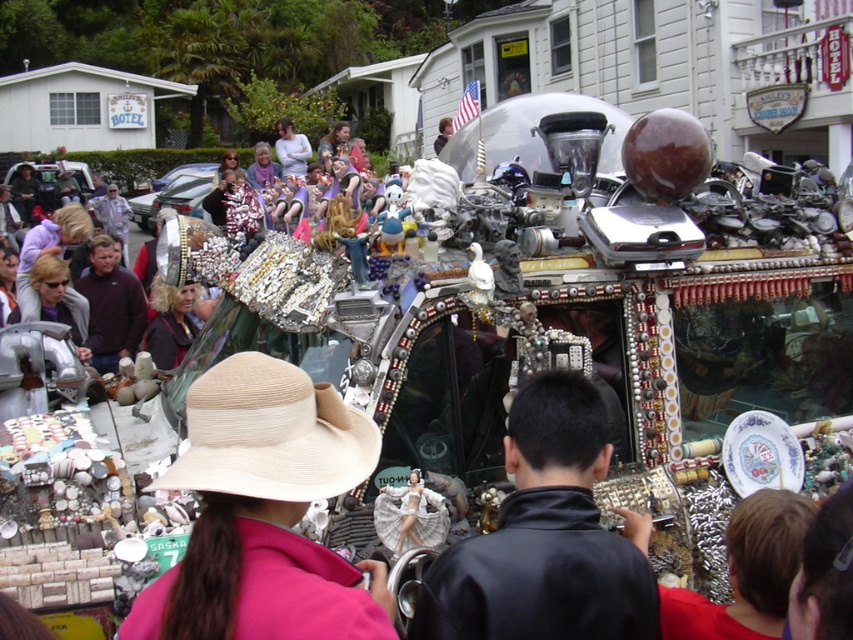
You are a photographer standing in the crowd watching the parade. You want to take a photo of both the pink fabric hat at center and the beige straw hat at center. Which hat will appear larger in your photo?

The pink fabric hat at center will appear larger in the photo because it is closer to the viewer than the beige straw hat at center.

You are a photographer trying to capture a clear photo of the pink fabric hat at center and the black leather jacket at center. Since you want both subjects to be in focus, which object should you adjust your camera focus on first to ensure clarity?

The pink fabric hat at center is shorter than the black leather jacket at center. To ensure both are in focus, you should focus on the black leather jacket at center first, as it is taller and will require the camera to adjust to a greater depth of field.

You are a photographer trying to capture a clear shot of both the pink fabric hat at center and the black leather jacket at center from your position at the back of the crowd. Since you want to ensure both are visible, which object should you focus on first to account for their sizes?

The pink fabric hat at center has a lesser width compared to the black leather jacket at center, so you should focus on the pink fabric hat at center first since it is smaller and might be harder to capture clearly.